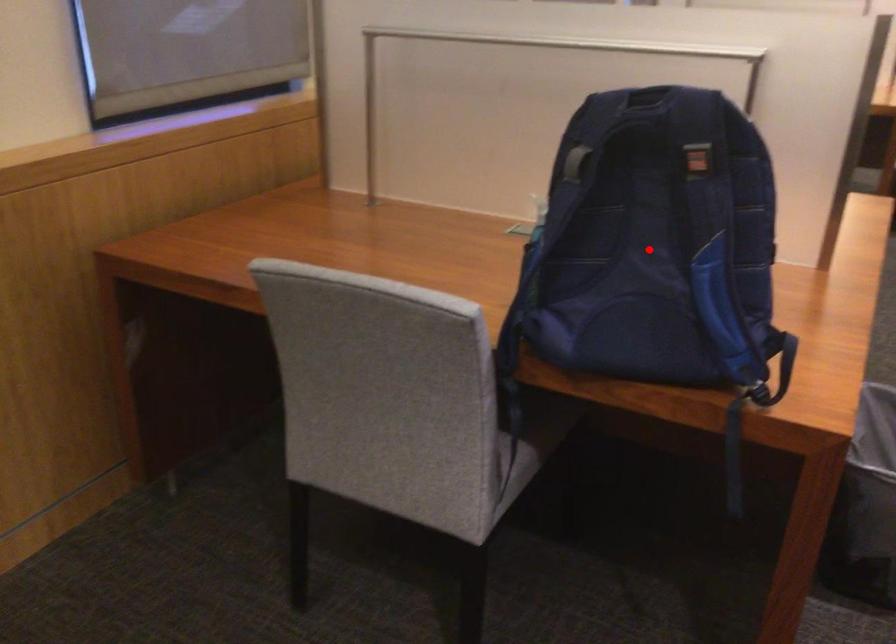
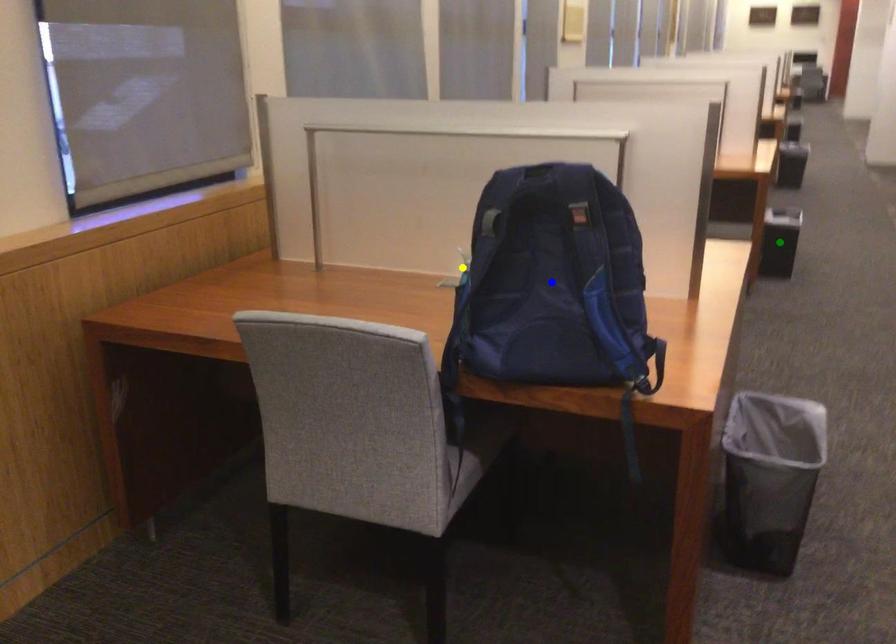
Question: I am providing you with two images of the same scene from different viewpoints. A red point is marked on the first image. You are given multiple points on the second image. Which spot in image 2 lines up with the point in image 1?

Choices:
 (A) green point
 (B) blue point
 (C) yellow point

Answer: (B)